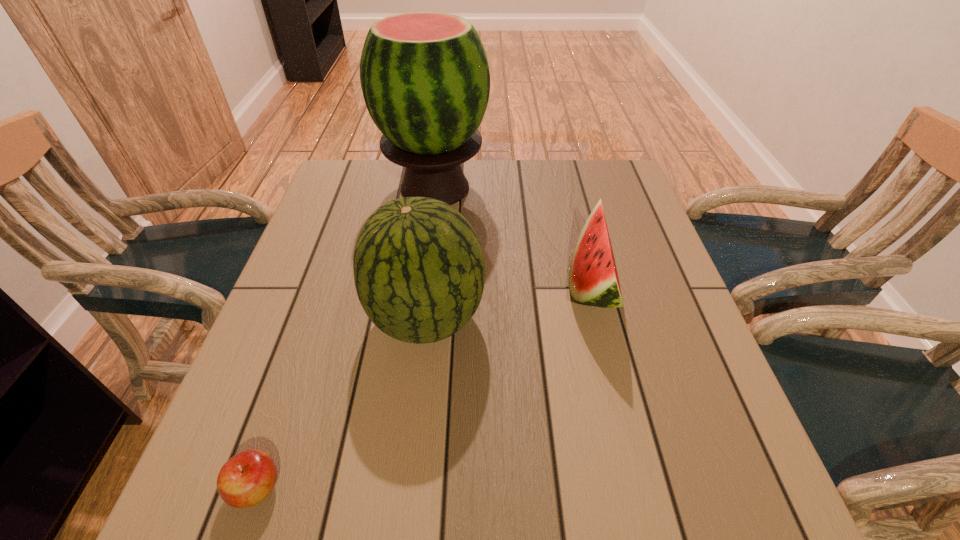
Locate an element on the screen. The image size is (960, 540). vacant position at the far edge of the desktop is located at coordinates [x=544, y=185].

In the image, there is a desktop. Where is `vacant region at the near edge`? vacant region at the near edge is located at coordinates (301, 514).

Image resolution: width=960 pixels, height=540 pixels. What are the coordinates of `blank space at the left edge` in the screenshot? It's located at (268, 440).

At what (x,y) coordinates should I click in order to perform the action: click on vacant space at the right edge. Please return your answer as a coordinate pair (x, y). The image size is (960, 540). Looking at the image, I should click on (649, 359).

In order to click on free spot at the far right corner of the desktop in this screenshot , I will do `click(600, 161)`.

This screenshot has width=960, height=540. What are the coordinates of `free region at the near right corner of the desktop` in the screenshot? It's located at (755, 513).

This screenshot has height=540, width=960. I want to click on free space between the leftmost object and the rightmost watermelon, so click(x=424, y=387).

I want to click on vacant region between the nearest object and the second tallest watermelon, so click(x=342, y=403).

The image size is (960, 540). I want to click on free space between the shortest watermelon and the farthest object, so click(x=514, y=237).

This screenshot has width=960, height=540. I want to click on unoccupied position between the rightmost watermelon and the apple, so pyautogui.click(x=424, y=387).